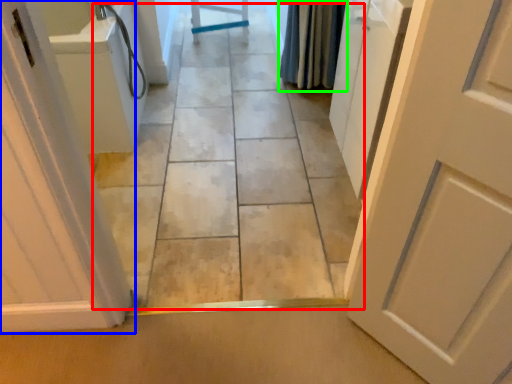
Question: Considering the real-world distances, which object is closest to path (highlighted by a red box)? door (highlighted by a blue box) or shower curtain (highlighted by a green box).

Choices:
 (A) door
 (B) shower curtain

Answer: (B)